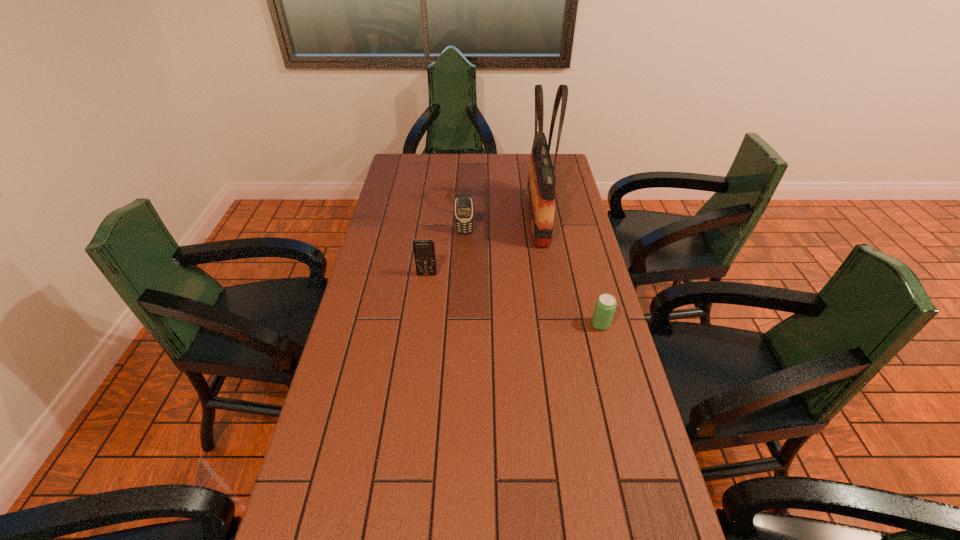
Locate an element on the screen. free space located on the front-facing side of the shopping bag is located at coordinates (492, 218).

The height and width of the screenshot is (540, 960). Identify the location of free region located 0.210m on the front face of the farther cellular telephone. (463, 273).

Find the location of a particular element. vacant space situated 0.150m on the screen of the second nearest object is located at coordinates (x=422, y=309).

Identify the location of vacant region located 0.350m on the back of the rightmost object. This screenshot has height=540, width=960. (580, 245).

Where is `shopping bag that is at the right edge`? shopping bag that is at the right edge is located at coordinates (541, 187).

Locate an element on the screen. This screenshot has height=540, width=960. soda that is at the right edge is located at coordinates (605, 306).

I want to click on vacant space at the far edge of the desktop, so click(x=485, y=179).

Identify the location of free space at the left edge. (396, 185).

What are the coordinates of `free space at the right edge of the desktop` in the screenshot? It's located at (561, 260).

You are a GUI agent. You are given a task and a screenshot of the screen. Output one action in this format:
    pyautogui.click(x=<x>, y=<y>)
    Task: Click on the free space that is in between the soda and the farther cellular telephone
    This screenshot has height=540, width=960.
    Given the screenshot: What is the action you would take?
    coord(533,279)